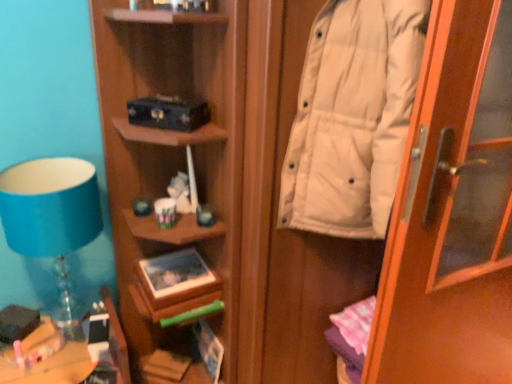
Question: Is matte green book at center, the 2th book from the top, oriented away from hardcover book at lower center, acting as the 4th book starting from the top?

Choices:
 (A) no
 (B) yes

Answer: (A)

Question: Is matte green book at center, the 2th book from the top, closer to the viewer compared to hardcover book at lower center, the first book positioned from the bottom?

Choices:
 (A) no
 (B) yes

Answer: (B)

Question: From the image's perspective, is matte green book at center, the 3th book in the bottom-to-top sequence, located above hardcover book at lower center, the first book positioned from the bottom?

Choices:
 (A) yes
 (B) no

Answer: (A)

Question: Is matte green book at center, the 3th book in the bottom-to-top sequence, aimed at hardcover book at lower center, the first book positioned from the bottom?

Choices:
 (A) yes
 (B) no

Answer: (B)

Question: Can you confirm if matte green book at center, the 3th book in the bottom-to-top sequence, is smaller than hardcover book at lower center, the first book positioned from the bottom?

Choices:
 (A) yes
 (B) no

Answer: (B)

Question: Is matte green book at center, the 3th book in the bottom-to-top sequence, thinner than hardcover book at lower center, the first book positioned from the bottom?

Choices:
 (A) yes
 (B) no

Answer: (B)

Question: Is matte blue glass at left closer to camera compared to white matte coat at right?

Choices:
 (A) no
 (B) yes

Answer: (A)

Question: Can you confirm if matte blue glass at left is shorter than white matte coat at right?

Choices:
 (A) no
 (B) yes

Answer: (B)

Question: From the image's perspective, is matte blue glass at left below white matte coat at right?

Choices:
 (A) no
 (B) yes

Answer: (B)

Question: Does matte blue glass at left have a smaller size compared to white matte coat at right?

Choices:
 (A) yes
 (B) no

Answer: (A)

Question: Is the depth of matte blue glass at left greater than that of white matte coat at right?

Choices:
 (A) yes
 (B) no

Answer: (A)

Question: From a real-world perspective, is matte blue glass at left below white matte coat at right?

Choices:
 (A) yes
 (B) no

Answer: (A)

Question: Is matte black book at upper center, the 1th book in the top-to-bottom sequence, wider than white matte door at right?

Choices:
 (A) yes
 (B) no

Answer: (B)